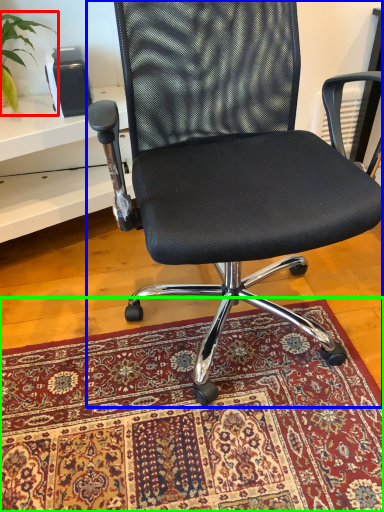
Question: Estimate the real-world distances between objects in this image. Which object is closer to plant (highlighted by a red box), chair (highlighted by a blue box) or mat (highlighted by a green box)?

Choices:
 (A) chair
 (B) mat

Answer: (A)